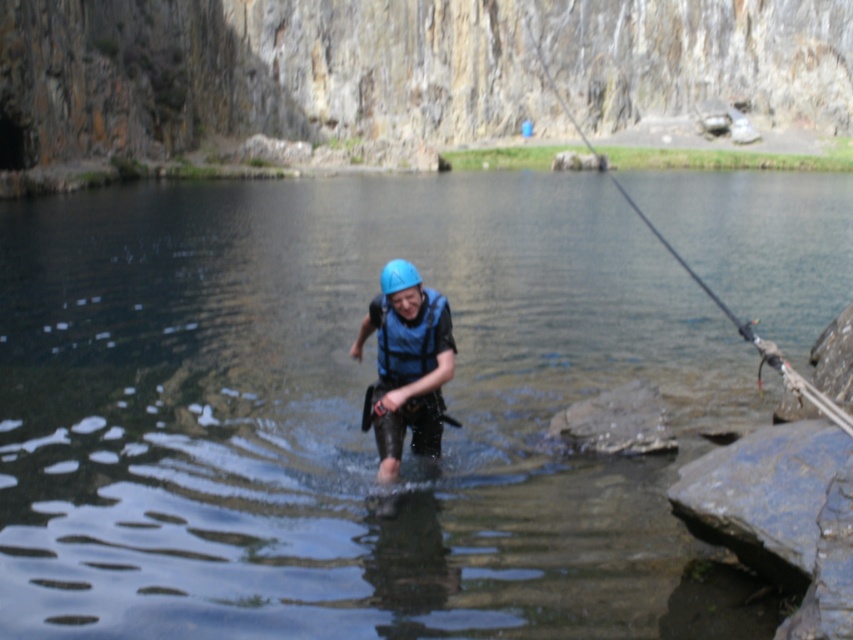
From the picture: You are a safety inspector assessing the equipment placement of the person in the image. Both the blue matte life vest at center and the blue matte helmet at center are essential. According to standard safety protocols, which item should be positioned higher to ensure proper safety?

The blue matte helmet at center should be positioned higher than the blue matte life vest at center to ensure proper safety, as helmets are typically worn on the head and vests on the torso.

You are a safety inspector checking the equipment of a canyoning participant. The regulations state that the distance between the safety vest and helmet must be less than 1.5 meters for proper positioning. Are the blue matte safety vest at center and blue matte helmet at center within the required distance?

The blue matte safety vest at center is 1.48 meters away from the blue matte helmet at center, which is within the required distance of less than 1.5 meters, so they are properly positioned.